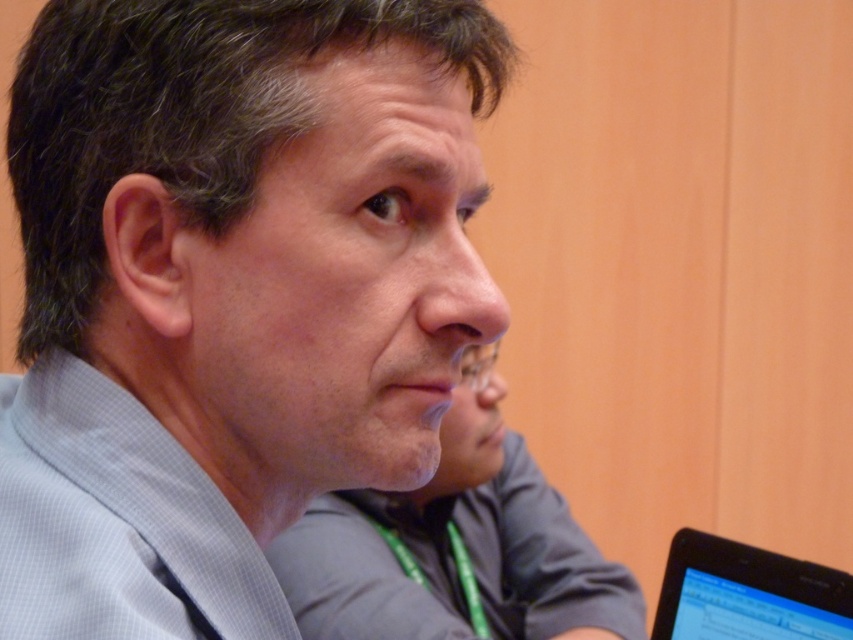
You are standing in the conference room and notice two points marked on the wall. The first point is at coordinates point (529, 614) and the second point is at point (740, 563). If you were to draw a line from your current position to each point, which point would require the line to pass closer to the laptop screen located at the bottom right corner?

Point (740, 563) is closer to the laptop screen at the bottom right corner than point (529, 614). Therefore, drawing a line to point (740, 563) would pass closer to the laptop screen located at the bottom right corner.

You are a photographer setting up for a group photo in the conference room. You see the gray checkered shirt at center and the camera. How far apart are these two items?

The gray checkered shirt at center and the camera are 13.28 inches apart from each other.

You are standing in a conference room and see a point marked at coordinates point (x=505, y=44). If you want to reach this point quickly, which direction should you move in relation to your current position?

The point (x=505, y=44) is 44.54 centimeters away from the viewer, so you should move forward towards it to reach it quickly.